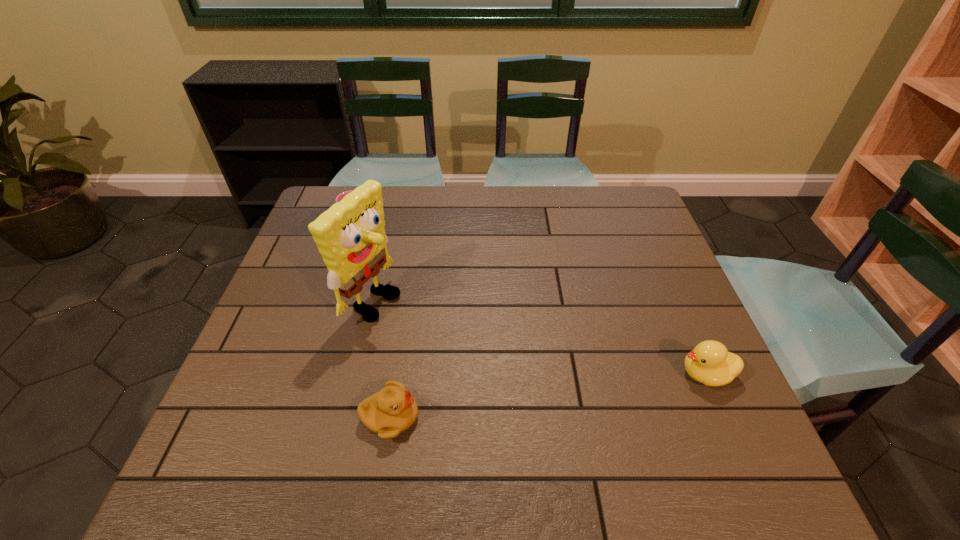
Locate an element on the screen. free location located 0.250m on the face of the sponge is located at coordinates (484, 353).

Image resolution: width=960 pixels, height=540 pixels. I want to click on free space located 0.270m on the face of the sponge, so [492, 357].

Where is `free space located 0.220m on the face of the sponge`? Image resolution: width=960 pixels, height=540 pixels. free space located 0.220m on the face of the sponge is located at coordinates (472, 348).

The width and height of the screenshot is (960, 540). Identify the location of blank area located on the side with the handle of the farthest object. [x=423, y=295].

The width and height of the screenshot is (960, 540). I want to click on vacant area located on the side with the handle of the farthest object, so click(398, 268).

This screenshot has width=960, height=540. What are the coordinates of `vacant area situated 0.340m on the side with the handle of the farthest object` in the screenshot? It's located at (423, 295).

Where is `object that is positioned at the far edge`? The height and width of the screenshot is (540, 960). object that is positioned at the far edge is located at coordinates (342, 195).

Identify the location of object at the near edge. (391, 411).

Where is `object that is positioned at the left edge`? Image resolution: width=960 pixels, height=540 pixels. object that is positioned at the left edge is located at coordinates (342, 195).

The height and width of the screenshot is (540, 960). In order to click on object that is at the right edge in this screenshot , I will do `click(710, 363)`.